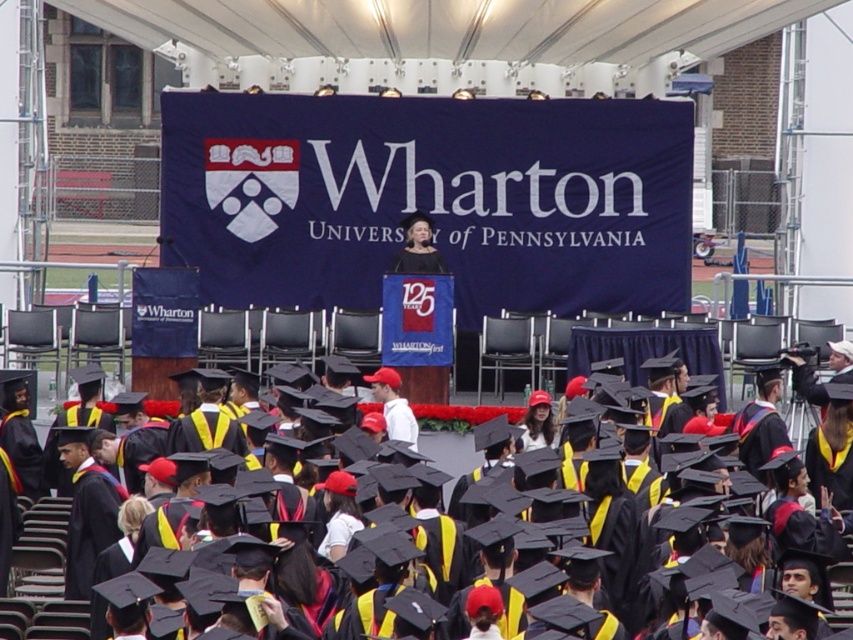
Between black matte graduation cap at center and matte black dress at center, which one has more height?

Standing taller between the two is black matte graduation cap at center.

Is black matte graduation cap at center to the right of matte black dress at center from the viewer's perspective?

In fact, black matte graduation cap at center is to the left of matte black dress at center.

Which is behind, point (36, 534) or point (408, 269)?

Point (408, 269)

This screenshot has height=640, width=853. I want to click on black matte graduation cap at center, so click(x=840, y=595).